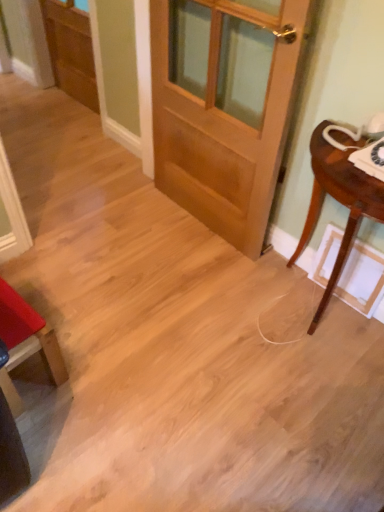
This screenshot has height=512, width=384. Find the location of `free point below light brown wood door at center (from a real-world perspective)`. free point below light brown wood door at center (from a real-world perspective) is located at coordinates (198, 225).